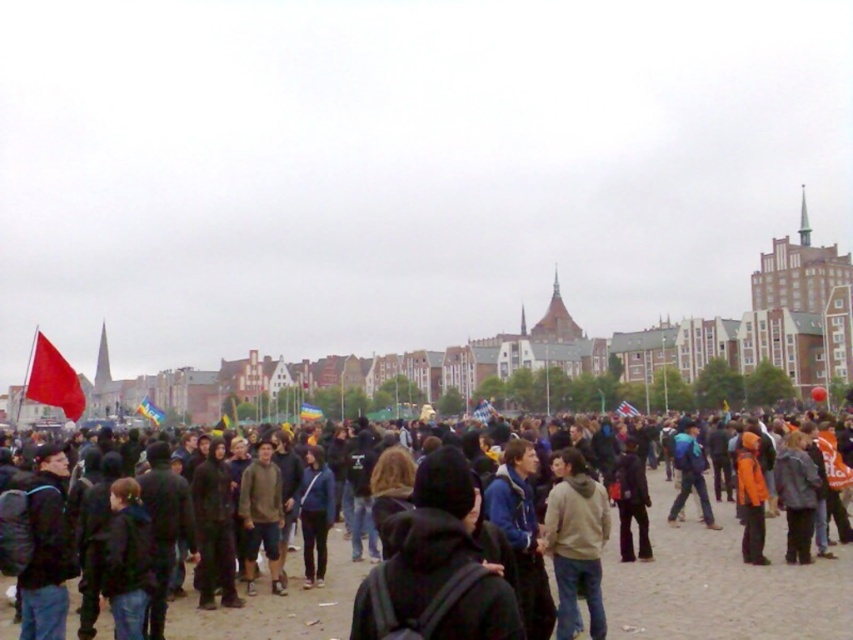
You are a photographer trying to capture the orange fabric jacket at center and the matte red flag at left in the same frame. Given their sizes, which object will appear larger in your photo?

The matte red flag at left will appear larger in the photo because it is bigger than the orange fabric jacket at center.

You are a photographer trying to capture the entire scene of the crowd and the flag. Given that the dark gray hoodie at center and the blue fabric flag at center are both at the center, which one should you focus on to ensure the other fits in the frame?

Since the dark gray hoodie at center occupies less space than the blue fabric flag at center, you should focus on the blue fabric flag at center to ensure the smaller dark gray hoodie at center fits in the frame.

You are a photographer trying to capture both the light brown hoodie at center and the rainbow fabric flag at center in a single frame. Given their sizes, which object should you focus on to ensure both are clearly visible in your photo?

The light brown hoodie at center is larger in size than the rainbow fabric flag at center, so you should focus on the light brown hoodie at center to ensure both are clearly visible in your photo.